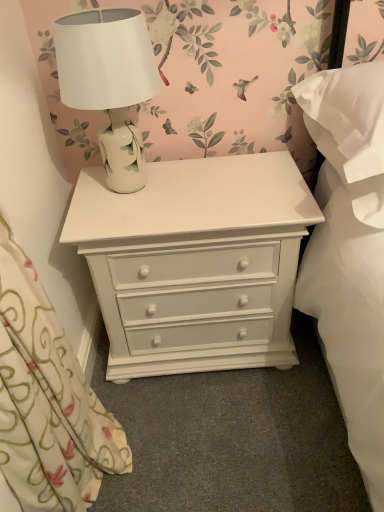
Question: Is white ceramic lamp at upper center next to white soft pillow at right?

Choices:
 (A) no
 (B) yes

Answer: (A)

Question: From a real-world perspective, is white ceramic lamp at upper center beneath white soft pillow at right?

Choices:
 (A) no
 (B) yes

Answer: (A)

Question: Can you confirm if white ceramic lamp at upper center is positioned to the left of white soft pillow at right?

Choices:
 (A) no
 (B) yes

Answer: (B)

Question: Considering the relative sizes of white ceramic lamp at upper center and white soft pillow at right in the image provided, is white ceramic lamp at upper center smaller than white soft pillow at right?

Choices:
 (A) yes
 (B) no

Answer: (A)

Question: Does white ceramic lamp at upper center come behind white soft pillow at right?

Choices:
 (A) yes
 (B) no

Answer: (A)

Question: From the image's perspective, is white painted wood chest of drawers at center located above or below floral fabric curtain at left?

Choices:
 (A) above
 (B) below

Answer: (A)

Question: Is point (178, 185) closer or farther from the camera than point (29, 402)?

Choices:
 (A) farther
 (B) closer

Answer: (A)

Question: Looking at the image, does white painted wood chest of drawers at center seem bigger or smaller compared to floral fabric curtain at left?

Choices:
 (A) big
 (B) small

Answer: (A)

Question: Visually, is white painted wood chest of drawers at center positioned to the left or to the right of floral fabric curtain at left?

Choices:
 (A) left
 (B) right

Answer: (B)

Question: Is white soft pillow at right taller or shorter than white ceramic lamp at upper center?

Choices:
 (A) tall
 (B) short

Answer: (B)

Question: Would you say white soft pillow at right is to the left or to the right of white ceramic lamp at upper center in the picture?

Choices:
 (A) right
 (B) left

Answer: (A)

Question: From the image's perspective, is white soft pillow at right positioned above or below white ceramic lamp at upper center?

Choices:
 (A) below
 (B) above

Answer: (A)

Question: In terms of width, does white soft pillow at right look wider or thinner when compared to white ceramic lamp at upper center?

Choices:
 (A) wide
 (B) thin

Answer: (A)

Question: From their relative heights in the image, would you say white ceramic lamp at upper center is taller or shorter than floral fabric curtain at left?

Choices:
 (A) short
 (B) tall

Answer: (A)

Question: Based on their sizes in the image, would you say white ceramic lamp at upper center is bigger or smaller than floral fabric curtain at left?

Choices:
 (A) small
 (B) big

Answer: (A)